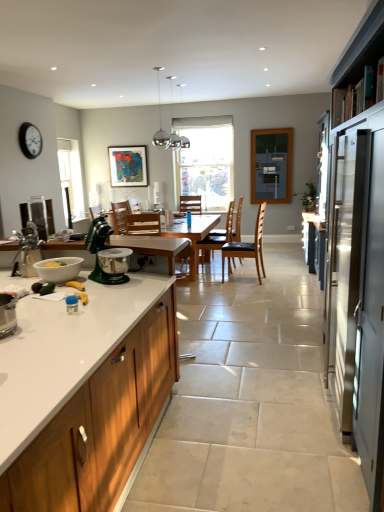
Question: Can you confirm if green metallic stand mixer at center, marked as the 1th appliance in a right-to-left arrangement, is taller than blue glass window screen at upper center?

Choices:
 (A) yes
 (B) no

Answer: (B)

Question: From the image's perspective, is green metallic stand mixer at center, marked as the second appliance in a front-to-back arrangement, on blue glass window screen at upper center?

Choices:
 (A) yes
 (B) no

Answer: (B)

Question: Does green metallic stand mixer at center, which appears as the second appliance when viewed from the back, appear on the right side of blue glass window screen at upper center?

Choices:
 (A) no
 (B) yes

Answer: (A)

Question: Is green metallic stand mixer at center, the 3th appliance positioned from the left, facing away from blue glass window screen at upper center?

Choices:
 (A) no
 (B) yes

Answer: (A)

Question: Does green metallic stand mixer at center, marked as the 1th appliance in a right-to-left arrangement, have a larger size compared to blue glass window screen at upper center?

Choices:
 (A) yes
 (B) no

Answer: (B)

Question: Is matte black clock at upper left a part of white glossy mixing bowl at lower left?

Choices:
 (A) yes
 (B) no

Answer: (B)

Question: From the image's perspective, is white glossy mixing bowl at lower left beneath matte black clock at upper left?

Choices:
 (A) no
 (B) yes

Answer: (B)

Question: Are white glossy mixing bowl at lower left and matte black clock at upper left beside each other?

Choices:
 (A) yes
 (B) no

Answer: (B)

Question: Is white glossy mixing bowl at lower left outside of matte black clock at upper left?

Choices:
 (A) yes
 (B) no

Answer: (A)

Question: Does white glossy mixing bowl at lower left turn towards matte black clock at upper left?

Choices:
 (A) yes
 (B) no

Answer: (B)

Question: Considering the relative sizes of white glossy mixing bowl at lower left and matte black clock at upper left in the image provided, is white glossy mixing bowl at lower left shorter than matte black clock at upper left?

Choices:
 (A) no
 (B) yes

Answer: (B)

Question: Can you confirm if wooden table at center is bigger than blue glass window screen at upper center?

Choices:
 (A) no
 (B) yes

Answer: (B)